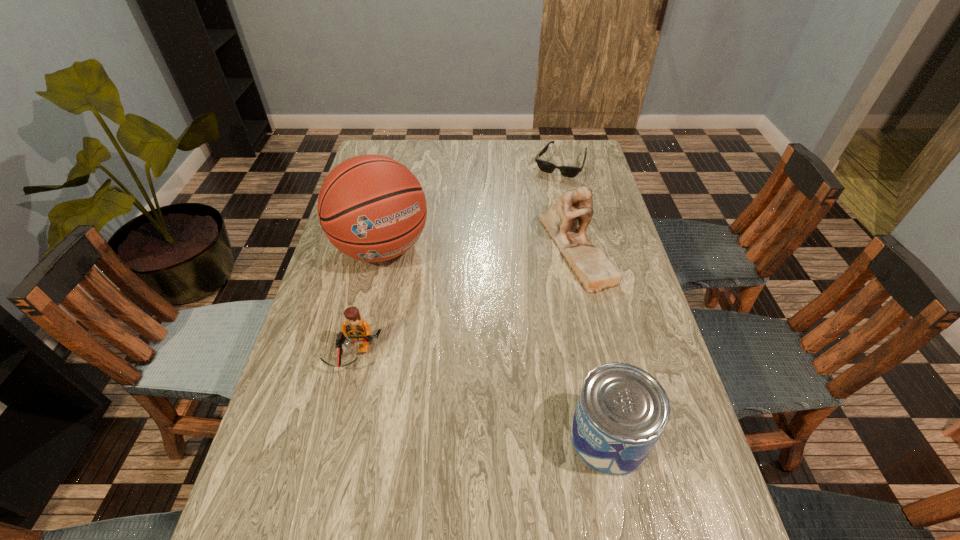
Where is `vacant region between the shortest object and the basketball`? Image resolution: width=960 pixels, height=540 pixels. vacant region between the shortest object and the basketball is located at coordinates (471, 206).

Where is `empty space that is in between the basketball and the can`? The image size is (960, 540). empty space that is in between the basketball and the can is located at coordinates (495, 342).

Find the location of a particular element. The height and width of the screenshot is (540, 960). empty space that is in between the figurine and the can is located at coordinates (591, 342).

You are a GUI agent. You are given a task and a screenshot of the screen. Output one action in this format:
    pyautogui.click(x=<x>, y=<y>)
    Task: Click on the vacant point located between the second tallest object and the tallest object
    The image size is (960, 540).
    Given the screenshot: What is the action you would take?
    pyautogui.click(x=478, y=247)

This screenshot has height=540, width=960. I want to click on empty space between the basketball and the farthest object, so click(471, 206).

Where is `object that is the closest to the fourth shortest object`? object that is the closest to the fourth shortest object is located at coordinates (568, 171).

Select which object is the third closest to the basketball. Please provide its 2D coordinates. Your answer should be formatted as a tuple, i.e. [(x, y)], where the tuple contains the x and y coordinates of a point satisfying the conditions above.

[(568, 171)]

Find the location of a particular element. vacant space that satisfies the following two spatial constraints: 1. on the front side of the basketball; 2. on the front label of the nearest object is located at coordinates (339, 437).

Locate an element on the screen. The image size is (960, 540). free space that satisfies the following two spatial constraints: 1. on the front side of the basketball; 2. on the front label of the third tallest object is located at coordinates (339, 437).

You are a GUI agent. You are given a task and a screenshot of the screen. Output one action in this format:
    pyautogui.click(x=<x>, y=<y>)
    Task: Click on the vacant area that satisfies the following two spatial constraints: 1. holding a crossbow in the hands of the Lego; 2. on the front label of the third tallest object
    The height and width of the screenshot is (540, 960).
    Given the screenshot: What is the action you would take?
    pyautogui.click(x=336, y=437)